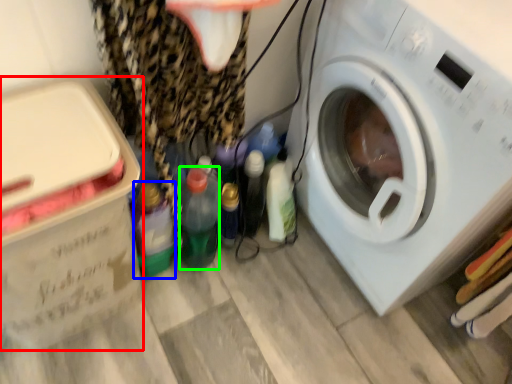
Question: Estimate the real-world distances between objects in this image. Which object is closer to cardboard box (highlighted by a red box), bottle (highlighted by a blue box) or bottle (highlighted by a green box)?

Choices:
 (A) bottle
 (B) bottle

Answer: (A)